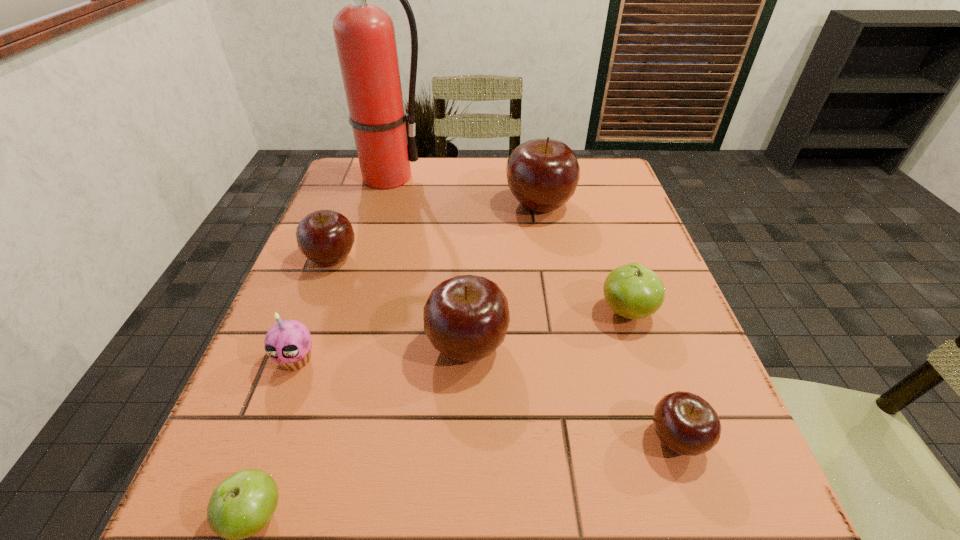
Image resolution: width=960 pixels, height=540 pixels. I want to click on fire extinguisher, so click(x=364, y=33).

You are a GUI agent. You are given a task and a screenshot of the screen. Output one action in this format:
    pyautogui.click(x=<x>, y=<y>)
    Task: Click on the farthest red apple
    The image size is (960, 540).
    Given the screenshot: What is the action you would take?
    (x=543, y=174)

Locate an element on the screen. This screenshot has height=540, width=960. the tallest apple is located at coordinates (543, 174).

Where is `the second nearest red apple`? The image size is (960, 540). the second nearest red apple is located at coordinates (466, 317).

Where is `the fourth object from right to left`? Image resolution: width=960 pixels, height=540 pixels. the fourth object from right to left is located at coordinates (466, 317).

Identify the location of the third farthest object. The image size is (960, 540). (326, 237).

Locate an element on the screen. Image resolution: width=960 pixels, height=540 pixels. the second smallest red apple is located at coordinates (326, 237).

At what (x,y) coordinates should I click in order to perform the action: click on the bigger green apple. Please return your answer as a coordinate pair (x, y). Looking at the image, I should click on (633, 291).

Where is `the farther green apple`? the farther green apple is located at coordinates (633, 291).

Image resolution: width=960 pixels, height=540 pixels. Find the location of `cupcake`. cupcake is located at coordinates (288, 342).